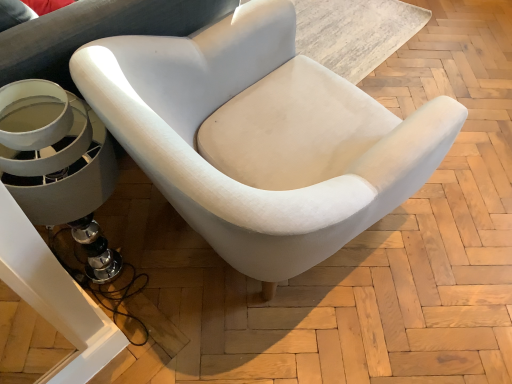
In order to click on white fabric chair at center in this screenshot , I will do `click(261, 138)`.

This screenshot has height=384, width=512. What do you see at coordinates (261, 138) in the screenshot?
I see `white fabric chair at center` at bounding box center [261, 138].

The width and height of the screenshot is (512, 384). I want to click on white fabric chair at center, so click(261, 138).